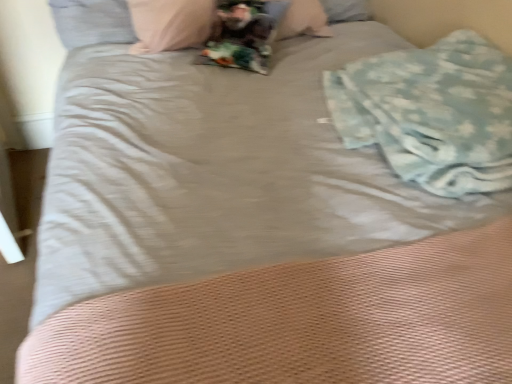
In order to face gray fabric pillow at upper left, should I rotate leftwards or rightwards?

You should rotate left by 20.174 degrees.

Where is `gray fabric pillow at upper left`? gray fabric pillow at upper left is located at coordinates (92, 22).

What do you see at coordinates (92, 22) in the screenshot? This screenshot has height=384, width=512. I see `gray fabric pillow at upper left` at bounding box center [92, 22].

This screenshot has height=384, width=512. What do you see at coordinates (432, 113) in the screenshot?
I see `light blue textured blanket at right` at bounding box center [432, 113].

Image resolution: width=512 pixels, height=384 pixels. In order to click on light blue textured blanket at right in this screenshot , I will do tap(432, 113).

In order to click on gray fabric pillow at upper left in this screenshot , I will do `click(92, 22)`.

Is gray fabric pillow at upper left to the right of light blue textured blanket at right from the viewer's perspective?

In fact, gray fabric pillow at upper left is to the left of light blue textured blanket at right.

In the image, is gray fabric pillow at upper left positioned in front of or behind light blue textured blanket at right?

gray fabric pillow at upper left is behind light blue textured blanket at right.

Between point (122, 22) and point (449, 171), which one is positioned behind?

The point (122, 22) is behind.

From the image's perspective, which is above, gray fabric pillow at upper left or light blue textured blanket at right?

gray fabric pillow at upper left.

Based on the photo, from a real-world perspective, is gray fabric pillow at upper left beneath light blue textured blanket at right?

Yes, from a real-world perspective, gray fabric pillow at upper left is below light blue textured blanket at right.

Does gray fabric pillow at upper left have a greater width compared to light blue textured blanket at right?

Incorrect, the width of gray fabric pillow at upper left does not surpass that of light blue textured blanket at right.

Considering the sizes of objects gray fabric pillow at upper left and light blue textured blanket at right in the image provided, who is taller, gray fabric pillow at upper left or light blue textured blanket at right?

gray fabric pillow at upper left is taller.

Does gray fabric pillow at upper left have a smaller size compared to light blue textured blanket at right?

Yes.

Is gray fabric pillow at upper left positioned beyond the bounds of light blue textured blanket at right?

Yes, gray fabric pillow at upper left is located beyond the bounds of light blue textured blanket at right.

Is there a large distance between gray fabric pillow at upper left and light blue textured blanket at right?

Absolutely, gray fabric pillow at upper left is distant from light blue textured blanket at right.

Does gray fabric pillow at upper left turn towards light blue textured blanket at right?

No, gray fabric pillow at upper left is not turned towards light blue textured blanket at right.

How different are the orientations of gray fabric pillow at upper left and light blue textured blanket at right in degrees?

The facing directions of gray fabric pillow at upper left and light blue textured blanket at right are 0.723 degrees apart.

How far apart are gray fabric pillow at upper left and light blue textured blanket at right?

The distance of gray fabric pillow at upper left from light blue textured blanket at right is 1.02 meters.

Locate an element on the screen. The width and height of the screenshot is (512, 384). pillow lying behind the light blue textured blanket at right is located at coordinates (92, 22).

Which object is positioned more to the left, light blue textured blanket at right or gray fabric pillow at upper left?

gray fabric pillow at upper left.

Is light blue textured blanket at right positioned in front of gray fabric pillow at upper left?

That is True.

Is point (502, 101) closer to viewer compared to point (122, 24)?

Yes, point (502, 101) is closer to viewer.

From the image's perspective, is light blue textured blanket at right over gray fabric pillow at upper left?

No, from the image's perspective, light blue textured blanket at right is not over gray fabric pillow at upper left.

From a real-world perspective, is light blue textured blanket at right physically located above or below gray fabric pillow at upper left?

From a real-world perspective, light blue textured blanket at right is physically above gray fabric pillow at upper left.

Between light blue textured blanket at right and gray fabric pillow at upper left, which one has larger width?

With larger width is light blue textured blanket at right.

Consider the image. Who is shorter, light blue textured blanket at right or gray fabric pillow at upper left?

Standing shorter between the two is light blue textured blanket at right.

Looking at the image, does light blue textured blanket at right seem bigger or smaller compared to gray fabric pillow at upper left?

light blue textured blanket at right is bigger than gray fabric pillow at upper left.

Is gray fabric pillow at upper left located within light blue textured blanket at right?

No, gray fabric pillow at upper left is not a part of light blue textured blanket at right.

Is light blue textured blanket at right positioned far away from gray fabric pillow at upper left?

Yes.

Is light blue textured blanket at right positioned with its back to gray fabric pillow at upper left?

No, light blue textured blanket at right is not facing away from gray fabric pillow at upper left.

In order to click on material in front of the gray fabric pillow at upper left in this screenshot , I will do `click(432, 113)`.

Where is `pillow above the light blue textured blanket at right (from the image's perspective)`? The image size is (512, 384). pillow above the light blue textured blanket at right (from the image's perspective) is located at coordinates (92, 22).

The image size is (512, 384). Identify the location of material that is on the right side of gray fabric pillow at upper left. (432, 113).